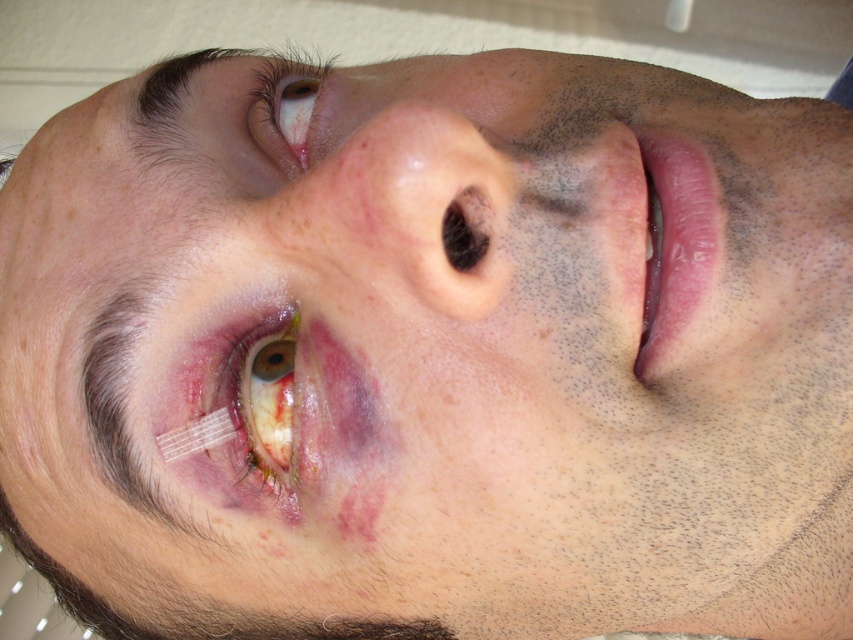
Question: Which of the following is the closest to the observer?

Choices:
 (A) (225, 381)
 (B) (351, 230)
 (C) (299, 84)
 (D) (209, 60)

Answer: (B)

Question: Can you confirm if pink smooth lips at center is thinner than swollen skin at lower left?

Choices:
 (A) no
 (B) yes

Answer: (B)

Question: Observing the image, what is the correct spatial positioning of pink skin/natural nose at center in reference to pink smooth lips at center?

Choices:
 (A) right
 (B) left

Answer: (B)

Question: Which object is closer to the camera taking this photo?

Choices:
 (A) pink skin/natural nose at center
 (B) swollen skin at lower left
 (C) pink smooth lips at center

Answer: (A)

Question: Is pink skin/natural nose at center wider than brown matte eye at upper left?

Choices:
 (A) no
 (B) yes

Answer: (B)

Question: Which point is farther from the camera taking this photo?

Choices:
 (A) (281, 385)
 (B) (654, 260)

Answer: (B)